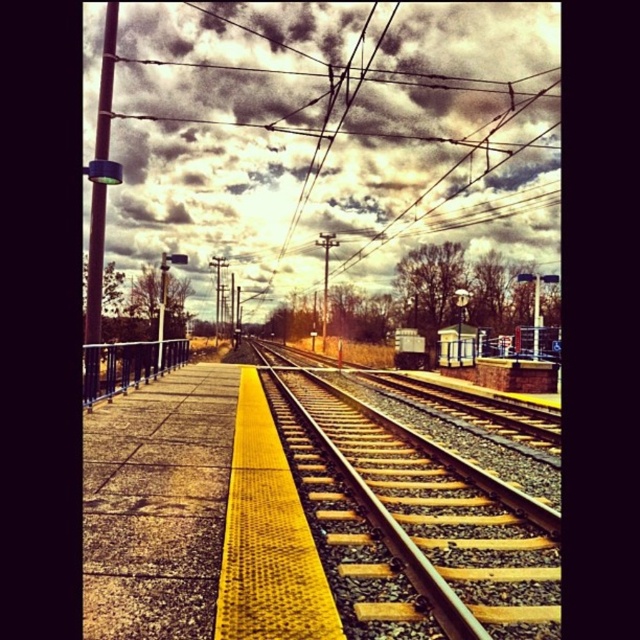
This screenshot has width=640, height=640. Find the location of `cloudy sky at upper center`. cloudy sky at upper center is located at coordinates (332, 134).

Which is behind, point (304, 269) or point (266, 125)?

The point (304, 269) is more distant.

At what (x,y) coordinates should I click in order to perform the action: click on cloudy sky at upper center. Please return your answer as a coordinate pair (x, y). Looking at the image, I should click on (332, 134).

Does metallic wires at center come behind metallic railing at left?

Yes, metallic wires at center is further from the viewer.

Between point (301, 196) and point (104, 380), which one is positioned in front?

Point (104, 380)

What do you see at coordinates (332, 113) in the screenshot? This screenshot has height=640, width=640. I see `metallic wires at center` at bounding box center [332, 113].

What are the coordinates of `metallic wires at center` in the screenshot? It's located at (332, 113).

Can you confirm if cloudy sky at upper center is taller than metallic railing at left?

Yes, cloudy sky at upper center is taller than metallic railing at left.

Based on the photo, who is more distant from viewer, (356, 128) or (145, 349)?

Point (356, 128)

Between point (348, 26) and point (145, 376), which one is positioned in front?

Point (145, 376) is more forward.

Locate an element on the screen. The image size is (640, 640). cloudy sky at upper center is located at coordinates (332, 134).